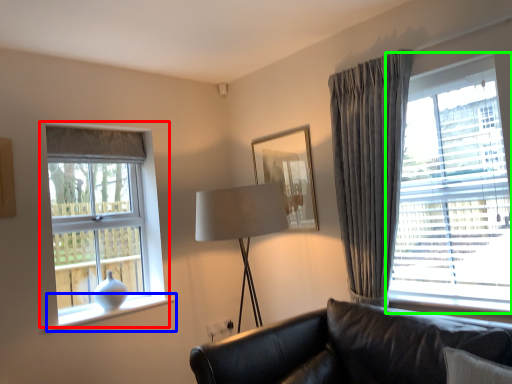
Question: Based on their relative distances, which object is nearer to window (highlighted by a red box)? Choose from window sill (highlighted by a blue box) and window (highlighted by a green box).

Choices:
 (A) window sill
 (B) window

Answer: (A)